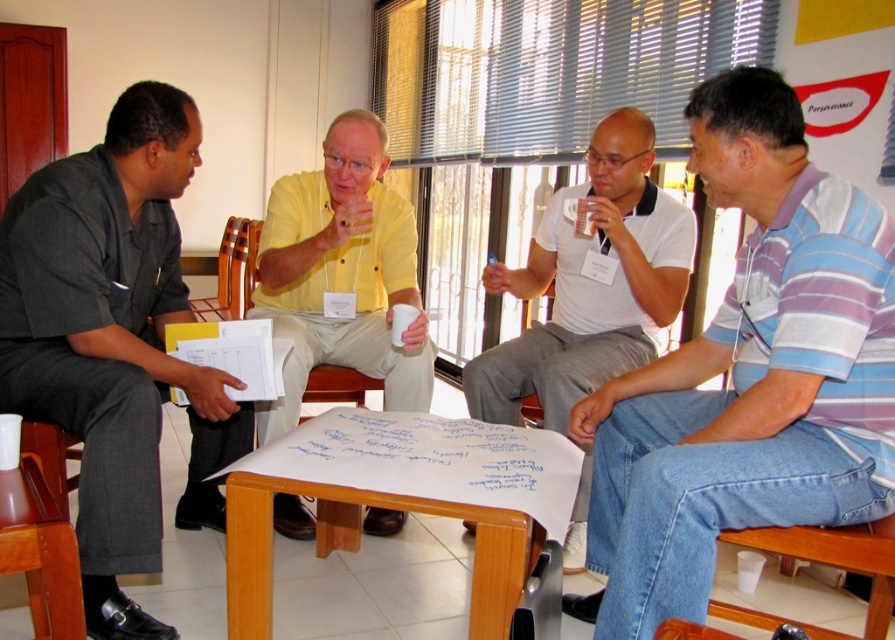
Is point (783, 516) in front of point (861, 545)?

Yes, it is.

Image resolution: width=895 pixels, height=640 pixels. In order to click on blue striped polo shirt at right in this screenshot , I will do `click(748, 376)`.

Between dark gray shirt at left and brown wood chair at lower left, which one appears on the left side from the viewer's perspective?

From the viewer's perspective, brown wood chair at lower left appears more on the left side.

Consider the image. Who is more forward, (91, 506) or (16, 444)?

Point (16, 444) is in front.

This screenshot has height=640, width=895. Describe the element at coordinates (114, 340) in the screenshot. I see `dark gray shirt at left` at that location.

Image resolution: width=895 pixels, height=640 pixels. What are the coordinates of `dark gray shirt at left` in the screenshot? It's located at (x=114, y=340).

Does blue striped polo shirt at right have a lesser width compared to brown wood chair at lower left?

Incorrect, blue striped polo shirt at right's width is not less than brown wood chair at lower left's.

Is point (754, 97) in front of point (18, 440)?

Yes, point (754, 97) is closer to viewer.

Identify the location of blue striped polo shirt at right. (748, 376).